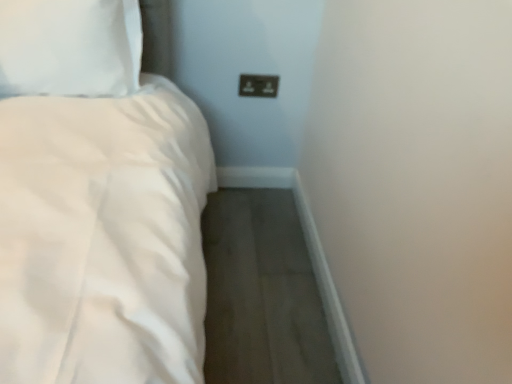
Question: Is white soft pillow at upper left facing towards brown plastic socket at upper center?

Choices:
 (A) yes
 (B) no

Answer: (B)

Question: Considering the relative sizes of white soft pillow at upper left and brown plastic socket at upper center in the image provided, is white soft pillow at upper left wider than brown plastic socket at upper center?

Choices:
 (A) no
 (B) yes

Answer: (B)

Question: Is white soft pillow at upper left shorter than brown plastic socket at upper center?

Choices:
 (A) no
 (B) yes

Answer: (A)

Question: Is white soft pillow at upper left far away from brown plastic socket at upper center?

Choices:
 (A) yes
 (B) no

Answer: (B)

Question: Considering the relative sizes of white soft pillow at upper left and brown plastic socket at upper center in the image provided, is white soft pillow at upper left thinner than brown plastic socket at upper center?

Choices:
 (A) yes
 (B) no

Answer: (B)

Question: Is white soft pillow at upper left placed right next to brown plastic socket at upper center?

Choices:
 (A) no
 (B) yes

Answer: (A)

Question: Is white soft pillow at upper left surrounded by brown plastic socket at upper center?

Choices:
 (A) no
 (B) yes

Answer: (A)

Question: From a real-world perspective, is brown plastic socket at upper center physically below white soft pillow at upper left?

Choices:
 (A) yes
 (B) no

Answer: (A)

Question: Is brown plastic socket at upper center with white soft pillow at upper left?

Choices:
 (A) no
 (B) yes

Answer: (A)

Question: Is brown plastic socket at upper center aimed at white soft pillow at upper left?

Choices:
 (A) yes
 (B) no

Answer: (B)

Question: Does brown plastic socket at upper center appear on the left side of white soft pillow at upper left?

Choices:
 (A) no
 (B) yes

Answer: (A)

Question: Is brown plastic socket at upper center outside of white soft pillow at upper left?

Choices:
 (A) yes
 (B) no

Answer: (A)

Question: Relative to white soft pillow at upper left, is brown plastic socket at upper center in front or behind?

Choices:
 (A) front
 (B) behind

Answer: (B)